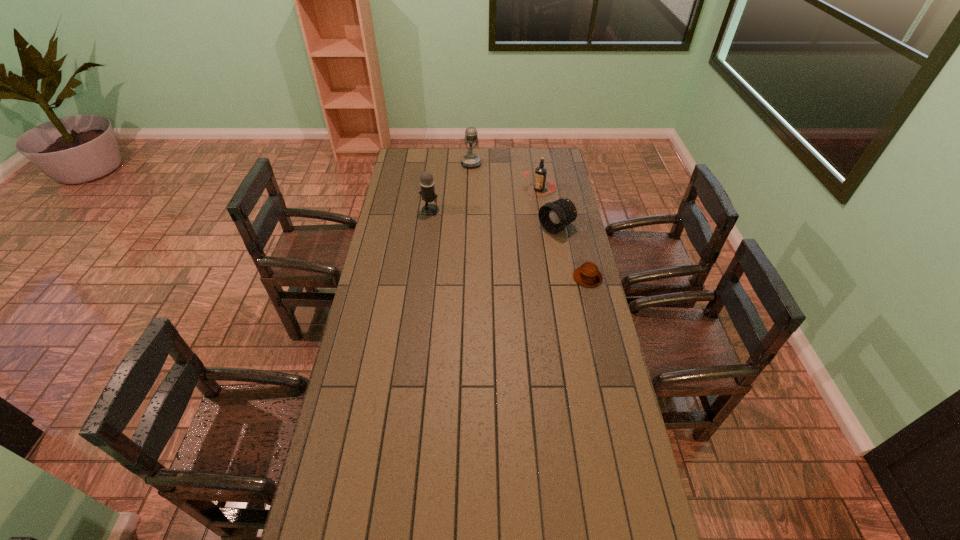
Locate an element on the screen. The width and height of the screenshot is (960, 540). the left microphone is located at coordinates (427, 192).

Locate an element on the screen. the leftmost object is located at coordinates (427, 192).

This screenshot has width=960, height=540. I want to click on the shortest object, so click(x=588, y=275).

Image resolution: width=960 pixels, height=540 pixels. I want to click on muffin, so pyautogui.click(x=588, y=275).

This screenshot has width=960, height=540. Identify the location of the second nearest object. (554, 216).

The height and width of the screenshot is (540, 960). Find the location of `telephoto lens`. telephoto lens is located at coordinates (554, 216).

Find the location of a particular element. Image resolution: width=960 pixels, height=540 pixels. root beer is located at coordinates (540, 173).

What are the coordinates of `the fourth nearest object` in the screenshot? It's located at (540, 173).

Find the location of a particular element. Image resolution: width=960 pixels, height=540 pixels. the fourth object from right to left is located at coordinates (470, 160).

In order to click on the farthest object in this screenshot , I will do `click(470, 160)`.